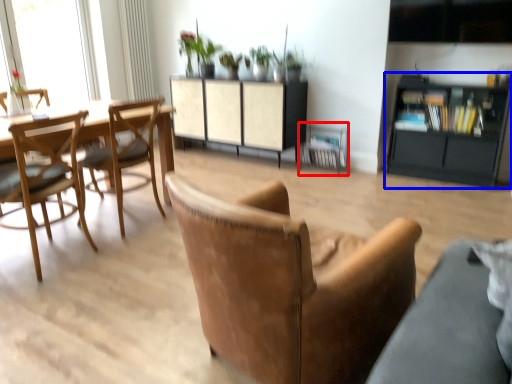
Question: Which object appears farthest to the camera in this image, armchair (highlighted by a red box) or cabinetry (highlighted by a blue box)?

Choices:
 (A) armchair
 (B) cabinetry

Answer: (A)